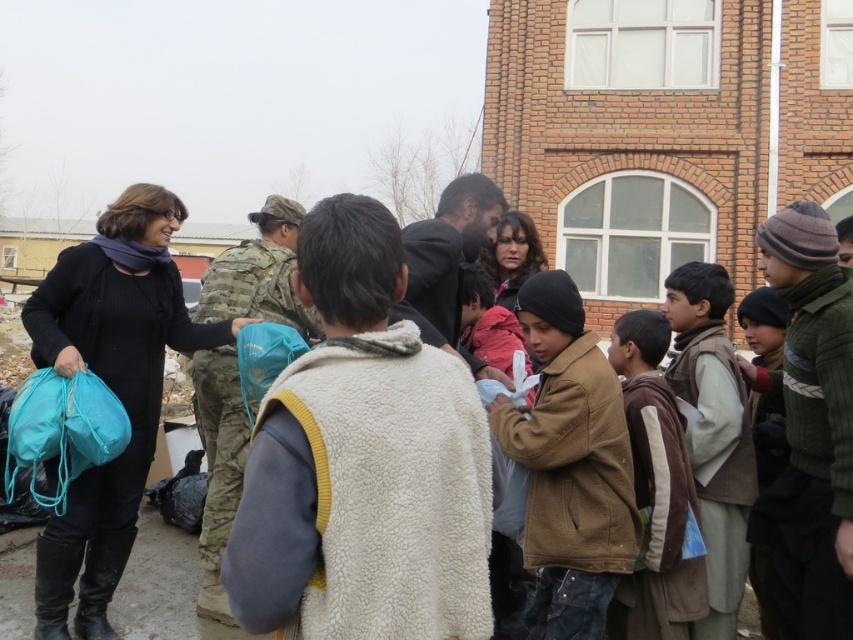
Is camouflage fabric uniform at center shorter than teal fabric backpack at center?

In fact, camouflage fabric uniform at center may be taller than teal fabric backpack at center.

Is camouflage fabric uniform at center positioned at the back of teal fabric backpack at center?

No, camouflage fabric uniform at center is closer to the viewer.

Is point (293, 298) positioned before point (242, 365)?

That is False.

Locate an element on the screen. The height and width of the screenshot is (640, 853). camouflage fabric uniform at center is located at coordinates (218, 465).

Does brown woolen vest at right lie behind matte blue fabric bag at lower left?

No, it is not.

Which of these two, brown woolen vest at right or matte blue fabric bag at lower left, stands taller?

brown woolen vest at right is taller.

Which is in front, point (698, 426) or point (49, 506)?

Positioned in front is point (49, 506).

This screenshot has width=853, height=640. Identify the location of brown woolen vest at right. (712, 433).

Does white fuzzy vest at center have a lesser height compared to brown woolen vest at right?

Yes.

Locate an element on the screen. white fuzzy vest at center is located at coordinates (363, 461).

Measure the distance between white fuzzy vest at center and camera.

They are 12.19 meters apart.

Locate an element on the screen. The height and width of the screenshot is (640, 853). white fuzzy vest at center is located at coordinates (363, 461).